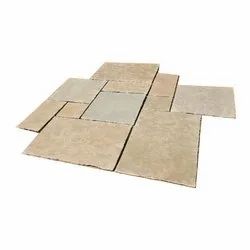
Locate an element on the screen. The height and width of the screenshot is (250, 250). tiles the size of two square tiles combined is located at coordinates (34, 119), (132, 85), (168, 88), (163, 117).